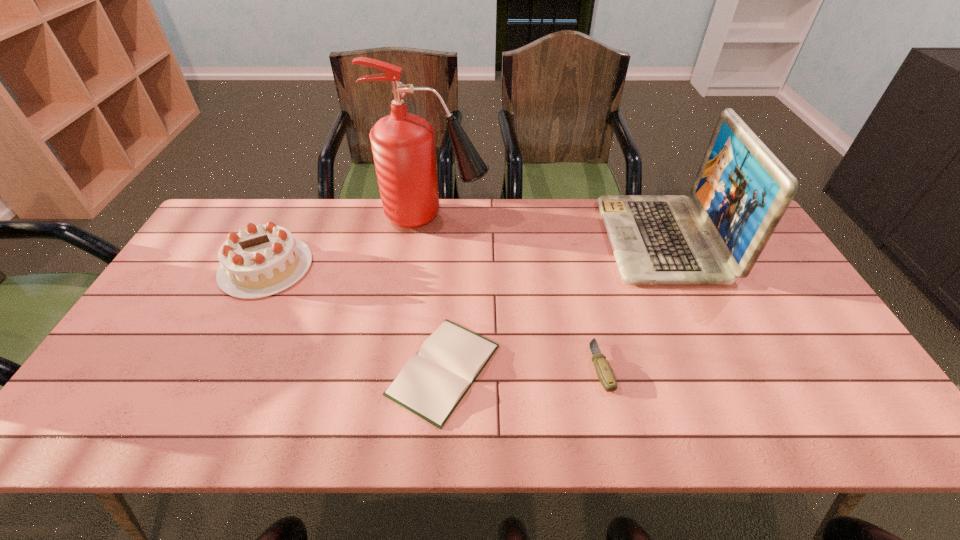
The image size is (960, 540). In order to click on blank region between the tallest object and the pocketknife in this screenshot , I will do `click(517, 291)`.

This screenshot has height=540, width=960. I want to click on empty location between the third shortest object and the fire extinguisher, so click(350, 242).

The height and width of the screenshot is (540, 960). In order to click on unoccupied position between the fire extinguisher and the leftmost object in this screenshot , I will do `click(350, 242)`.

In order to click on unoccupied area between the rightmost object and the fourth tallest object in this screenshot , I will do `click(632, 303)`.

I want to click on free spot between the fourth tallest object and the laptop computer, so click(x=632, y=303).

Find the location of a particular element. vacant space in between the second tallest object and the shortest object is located at coordinates (553, 305).

This screenshot has width=960, height=540. Identify the location of unoccupied position between the fourth shortest object and the third tallest object. (464, 253).

Point out which object is positioned as the second nearest to the second object from right to left. Please provide its 2D coordinates. Your answer should be formatted as a tuple, i.e. [(x, y)], where the tuple contains the x and y coordinates of a point satisfying the conditions above.

[(432, 383)]

Locate which object ranks second in proximity to the second object from right to left. Please provide its 2D coordinates. Your answer should be formatted as a tuple, i.e. [(x, y)], where the tuple contains the x and y coordinates of a point satisfying the conditions above.

[(432, 383)]

This screenshot has width=960, height=540. I want to click on free space that satisfies the following two spatial constraints: 1. with the nozzle aimed from the fourth tallest object; 2. on the right side of the fire extinguisher, so click(417, 366).